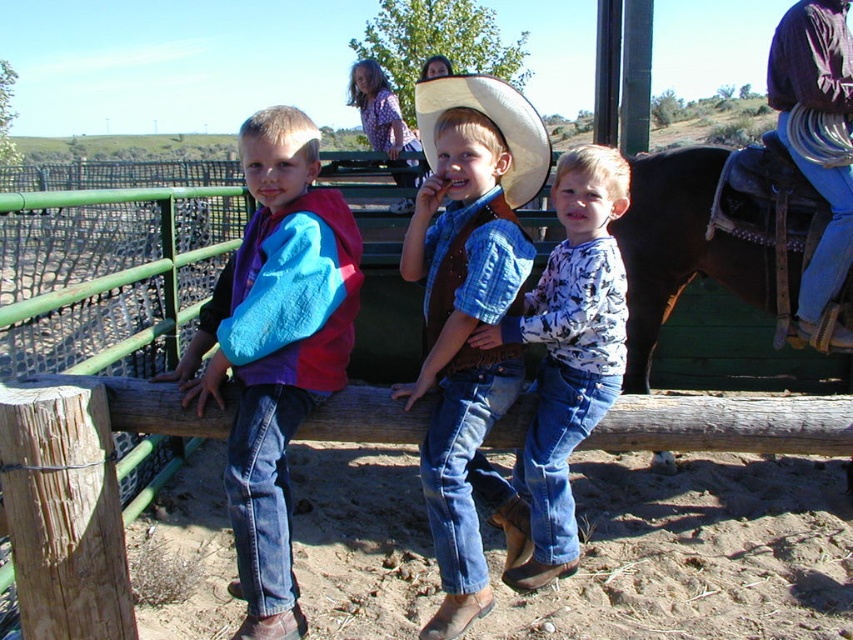
You are a photographer trying to capture a clear photo of the white printed shirt at center and the white straw hat at center. Which object is closer to the camera?

The white printed shirt at center is closer to the camera because the white straw hat at center is behind it.

You are a photographer trying to capture a closeup of the white printed shirt at center and the white straw hat at center. Which object is wider when viewed from your camera lens?

The white printed shirt at center is wider than the white straw hat at center.